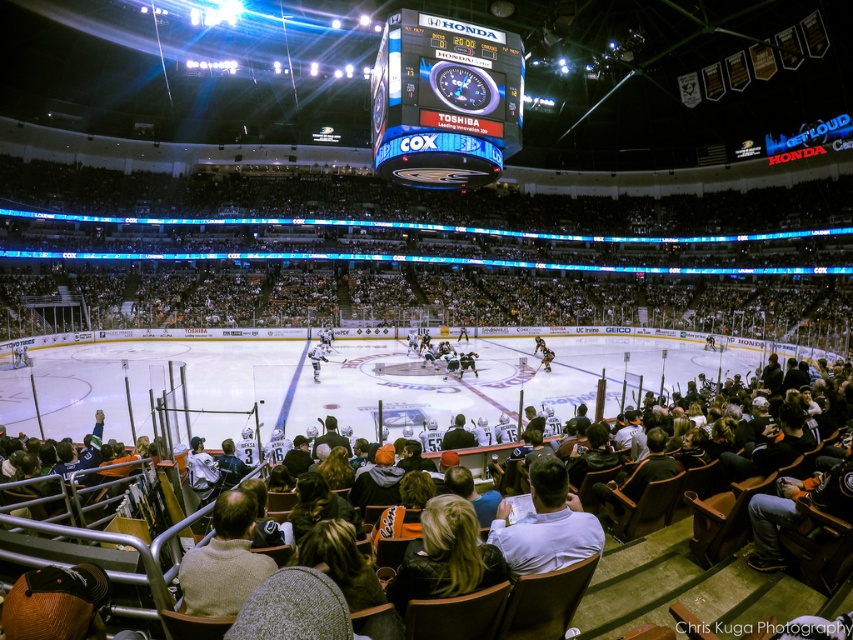
Question: Is blue glossy scoreboard at upper center above beige sweater at lower center?

Choices:
 (A) yes
 (B) no

Answer: (A)

Question: Which point is closer to the camera taking this photo?

Choices:
 (A) (544, 348)
 (B) (219, 493)

Answer: (B)

Question: Does white shirt at center appear over white jersey at center?

Choices:
 (A) no
 (B) yes

Answer: (A)

Question: Which point is closer to the camera?

Choices:
 (A) (312, 378)
 (B) (194, 611)
 (C) (447, 360)
 (D) (440, 40)

Answer: (B)

Question: Where is blue glossy scoreboard at upper center located in relation to white jersey at center in the image?

Choices:
 (A) above
 (B) below

Answer: (A)

Question: Which object appears farthest from the camera in this image?

Choices:
 (A) blue glossy scoreboard at upper center
 (B) white shirt at center
 (C) beige sweater at lower center
 (D) white jersey at center

Answer: (D)